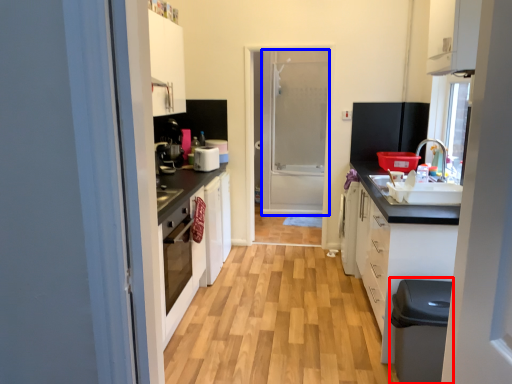
Question: Among these objects, which one is farthest to the camera, dish washer (highlighted by a red box) or screen door (highlighted by a blue box)?

Choices:
 (A) dish washer
 (B) screen door

Answer: (B)